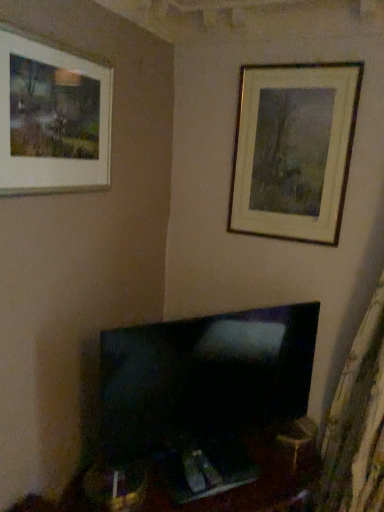
Question: From a real-world perspective, is matte white picture frame at upper left, which ranks as the 1th picture frame in left-to-right order, below gold metallic picture frame at upper right, marked as the first picture frame in a back-to-front arrangement?

Choices:
 (A) yes
 (B) no

Answer: (B)

Question: Is matte white picture frame at upper left, which is the second picture frame in right-to-left order, closer to camera compared to gold metallic picture frame at upper right, the 2th picture frame from the left?

Choices:
 (A) yes
 (B) no

Answer: (A)

Question: Is matte white picture frame at upper left, positioned as the 1th picture frame in front-to-back order, not near gold metallic picture frame at upper right, which is the second picture frame in front-to-back order?

Choices:
 (A) no
 (B) yes

Answer: (A)

Question: Does matte white picture frame at upper left, which is the second picture frame in right-to-left order, turn towards gold metallic picture frame at upper right, marked as the first picture frame in a back-to-front arrangement?

Choices:
 (A) yes
 (B) no

Answer: (B)

Question: From the image's perspective, does matte white picture frame at upper left, which is the second picture frame in right-to-left order, appear lower than gold metallic picture frame at upper right, the 2th picture frame from the left?

Choices:
 (A) yes
 (B) no

Answer: (A)

Question: Considering the relative sizes of matte white picture frame at upper left, which ranks as the 1th picture frame in left-to-right order, and gold metallic picture frame at upper right, which is the second picture frame in front-to-back order, in the image provided, is matte white picture frame at upper left, which ranks as the 1th picture frame in left-to-right order, thinner than gold metallic picture frame at upper right, which is the second picture frame in front-to-back order,?

Choices:
 (A) yes
 (B) no

Answer: (B)

Question: Is black glossy tv at center closer to camera compared to gold metallic picture frame at upper right, marked as the first picture frame in a back-to-front arrangement?

Choices:
 (A) yes
 (B) no

Answer: (A)

Question: Could you tell me if black glossy tv at center is facing gold metallic picture frame at upper right, which is the second picture frame in front-to-back order?

Choices:
 (A) yes
 (B) no

Answer: (B)

Question: From a real-world perspective, is black glossy tv at center on gold metallic picture frame at upper right, marked as the first picture frame in a back-to-front arrangement?

Choices:
 (A) yes
 (B) no

Answer: (B)

Question: From the image's perspective, is black glossy tv at center under gold metallic picture frame at upper right, which is the second picture frame in front-to-back order?

Choices:
 (A) yes
 (B) no

Answer: (A)

Question: Does black glossy tv at center lie behind gold metallic picture frame at upper right, the 2th picture frame from the left?

Choices:
 (A) no
 (B) yes

Answer: (A)

Question: Is black glossy tv at center located outside gold metallic picture frame at upper right, which is the second picture frame in front-to-back order?

Choices:
 (A) yes
 (B) no

Answer: (A)

Question: Considering the relative sizes of gold metallic picture frame at upper right, which ranks as the 1th picture frame in right-to-left order, and matte white picture frame at upper left, placed as the second picture frame when sorted from back to front, in the image provided, is gold metallic picture frame at upper right, which ranks as the 1th picture frame in right-to-left order, smaller than matte white picture frame at upper left, placed as the second picture frame when sorted from back to front,?

Choices:
 (A) no
 (B) yes

Answer: (B)